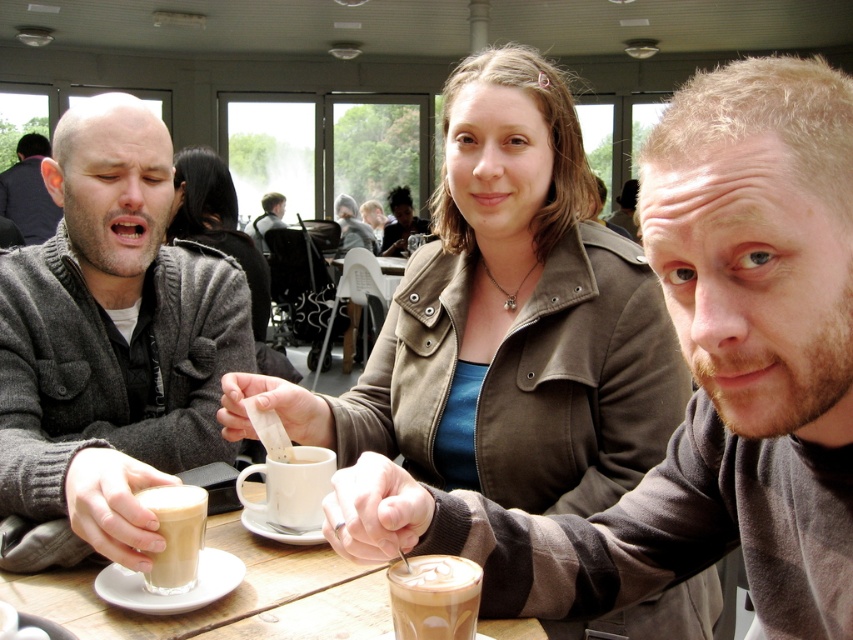
You are a barista at the cafe and want to place a new coffee order on the table. The table has limited space between the matte gray sweater at center and the white frothy coffee at center. Can you fit a coffee cup that is 10 cm in diameter between them?

The matte gray sweater at center is wider than the white frothy coffee at center. However, without knowing the exact distance between them, it is impossible to determine if the 10 cm diameter coffee cup will fit.

You are a photographer standing at the camera position. You want to take a closeup shot of the white ceramic mug at center. Is the mug within your camera frame? The camera has a focal length of 50mm and the minimum focusing distance is 30 inches.

The white ceramic mug at center is 37.01 inches away from the camera. Since the minimum focusing distance is 30 inches, the camera can focus on the mug. Therefore, the white ceramic mug at center is within the camera frame.

You are a photographer setting up a tripod at coordinates point 0.300, 0.034. You need to place it where the matte black jacket at left is located. Is there enough space for the tripod?

The matte black jacket at left is located at point (28, 192), so yes, you can place the tripod there as it matches the coordinates provided.